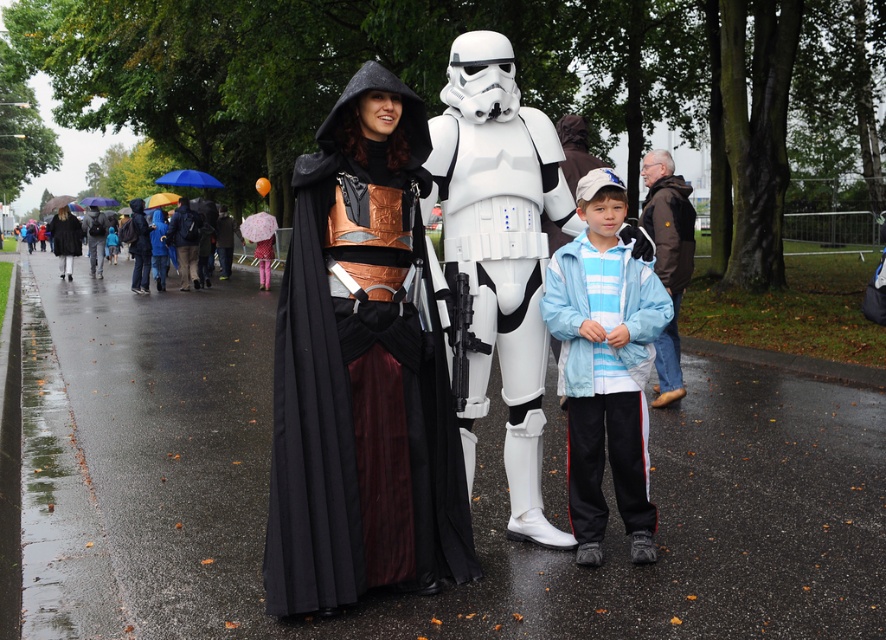
Does velvet-like black cape at center have a greater height compared to brown leather jacket at center?

Correct, velvet-like black cape at center is much taller as brown leather jacket at center.

Which is behind, point (320, 227) or point (690, 220)?

Point (690, 220)

Between point (364, 81) and point (667, 248), which one is positioned in front?

Point (364, 81) is in front.

Locate an element on the screen. The image size is (886, 640). velvet-like black cape at center is located at coordinates (362, 371).

Between matte black jacket at center and blue fabric umbrella at upper left, which one has more height?

blue fabric umbrella at upper left is taller.

The height and width of the screenshot is (640, 886). What do you see at coordinates (95, 237) in the screenshot? I see `matte black jacket at center` at bounding box center [95, 237].

Is point (84, 227) positioned before point (185, 172)?

That is False.

You are a GUI agent. You are given a task and a screenshot of the screen. Output one action in this format:
    pyautogui.click(x=<x>, y=<y>)
    Task: Click on the matte black jacket at center
    This screenshot has width=886, height=640.
    Given the screenshot: What is the action you would take?
    pyautogui.click(x=95, y=237)

Which is in front, point (658, 275) or point (98, 272)?

Positioned in front is point (658, 275).

From the picture: Can you confirm if brown leather jacket at center is positioned to the right of matte black jacket at center?

Indeed, brown leather jacket at center is positioned on the right side of matte black jacket at center.

Between point (659, 214) and point (92, 250), which one is positioned in front?

Point (659, 214) is in front.

You are a GUI agent. You are given a task and a screenshot of the screen. Output one action in this format:
    pyautogui.click(x=<x>, y=<y>)
    Task: Click on the brown leather jacket at center
    
    Given the screenshot: What is the action you would take?
    pyautogui.click(x=667, y=259)